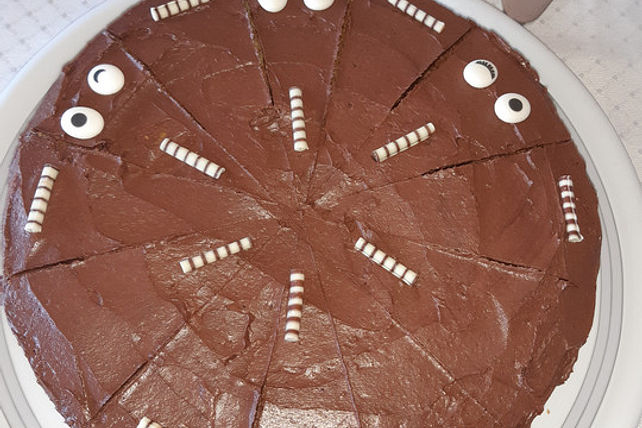
This screenshot has height=428, width=642. What are the coordinates of `white plate` in the screenshot? It's located at (616, 196).